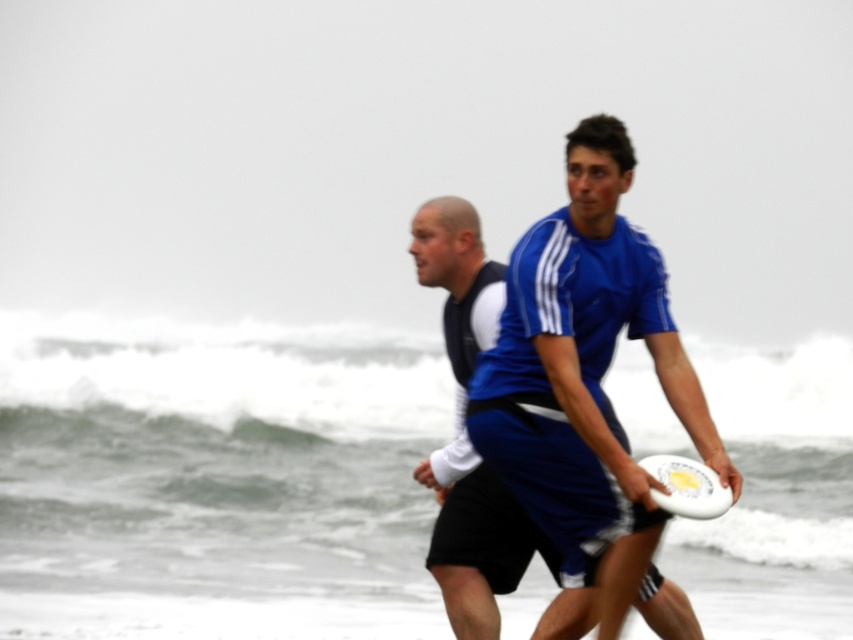
From the picture: Does white foamy wave at center appear over blue fabric shirt at center?

Yes.

Based on the photo, does white foamy wave at center appear on the right side of blue fabric shirt at center?

Yes, white foamy wave at center is to the right of blue fabric shirt at center.

The height and width of the screenshot is (640, 853). Describe the element at coordinates (215, 456) in the screenshot. I see `white foamy wave at center` at that location.

The width and height of the screenshot is (853, 640). I want to click on white foamy wave at center, so click(x=215, y=456).

Between blue fabric shirt at center and white plastic frisbee at center, which one appears on the right side from the viewer's perspective?

white plastic frisbee at center is more to the right.

Does blue fabric shirt at center come behind white plastic frisbee at center?

That is True.

Between point (482, 321) and point (689, 499), which one is positioned behind?

The point (482, 321) is more distant.

The image size is (853, 640). What are the coordinates of `blue fabric shirt at center` in the screenshot? It's located at (x=467, y=435).

Who is positioned more to the right, white foamy wave at center or white plastic frisbee at center?

white plastic frisbee at center is more to the right.

Can you confirm if white foamy wave at center is smaller than white plastic frisbee at center?

No.

Image resolution: width=853 pixels, height=640 pixels. I want to click on white foamy wave at center, so click(215, 456).

I want to click on white foamy wave at center, so click(215, 456).